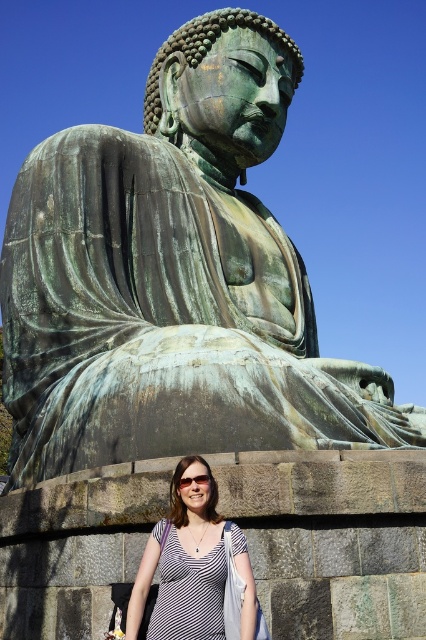
Is point (140, 621) positioned behind point (178, 480)?

No.

Image resolution: width=426 pixels, height=640 pixels. Find the location of `white striped shirt at lower center`. white striped shirt at lower center is located at coordinates (184, 564).

This screenshot has height=640, width=426. Find the location of `white striped shirt at lower center`. white striped shirt at lower center is located at coordinates (184, 564).